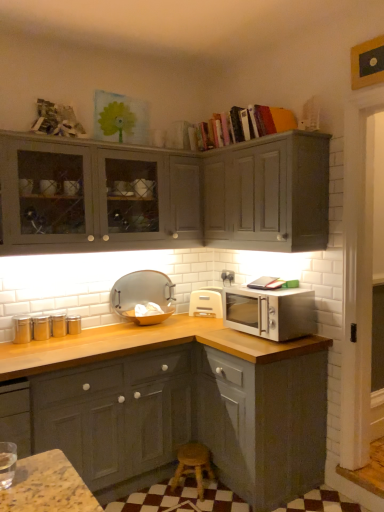
Where is `blank space situated above satin silver microwave at right (from a real-world perspective)`? blank space situated above satin silver microwave at right (from a real-world perspective) is located at coordinates (274, 286).